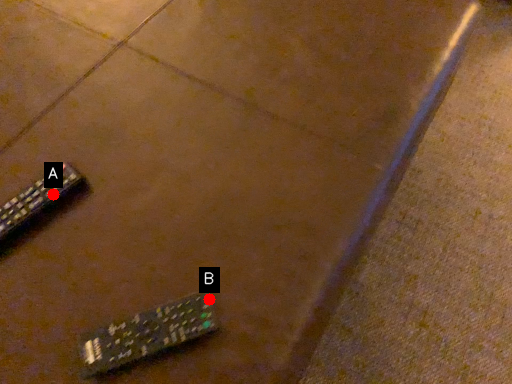
Question: Two points are circled on the image, labeled by A and B beside each circle. Among these points, which one is farthest from the camera?

Choices:
 (A) A is further
 (B) B is further

Answer: (A)